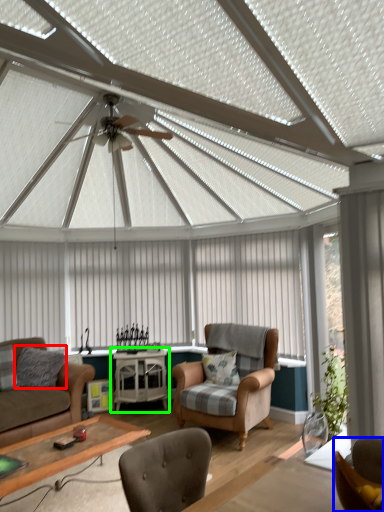
Question: Estimate the real-world distances between objects in this image. Which object is closer to pillow (highlighted by a red box), chair (highlighted by a blue box) or table (highlighted by a green box)?

Choices:
 (A) chair
 (B) table

Answer: (B)